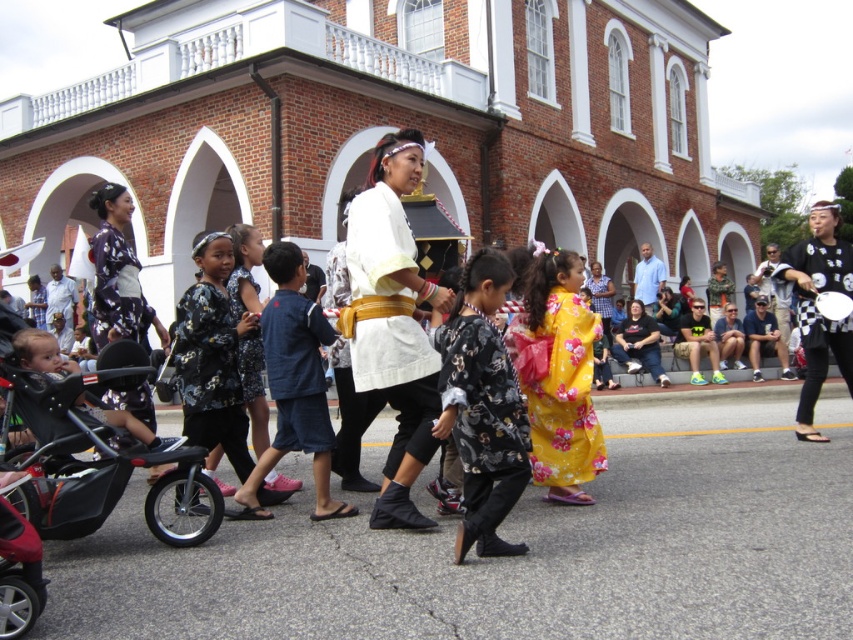
Question: Considering the real-world distances, which object is farthest from the black floral kimono at center?

Choices:
 (A) black plastic stroller at lower left
 (B) yellow floral kimono at center
 (C) black satin kimono at left
 (D) checkered fabric fan at right

Answer: (D)

Question: Is white cotton kimono at center below floral-patterned kimono at center?

Choices:
 (A) no
 (B) yes

Answer: (A)

Question: Which point is farther to the camera?

Choices:
 (A) floral-patterned kimono at center
 (B) black floral kimono at center
 (C) yellow floral kimono at center
 (D) white cotton kimono at center

Answer: (A)

Question: Which is farther from the black plastic stroller at lower left?

Choices:
 (A) checkered fabric fan at right
 (B) white matte kimono at center

Answer: (A)

Question: Does white cotton kimono at center lie behind checkered fabric fan at right?

Choices:
 (A) yes
 (B) no

Answer: (B)

Question: From the image, what is the correct spatial relationship of black plastic stroller at lower left in relation to yellow floral kimono at center?

Choices:
 (A) below
 (B) above

Answer: (A)